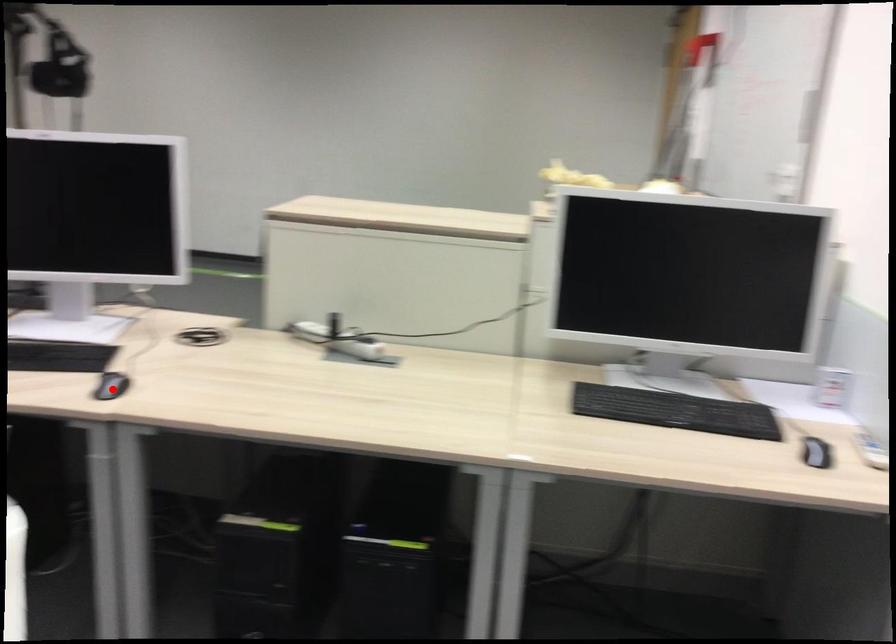
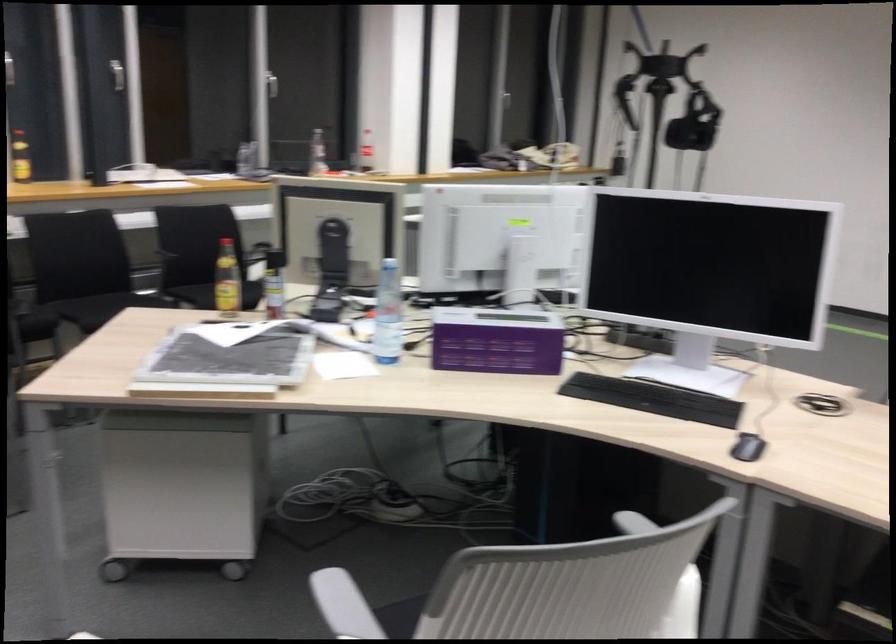
Where in the second image is the point corresponding to the highlighted location from the first image?

(747, 447)